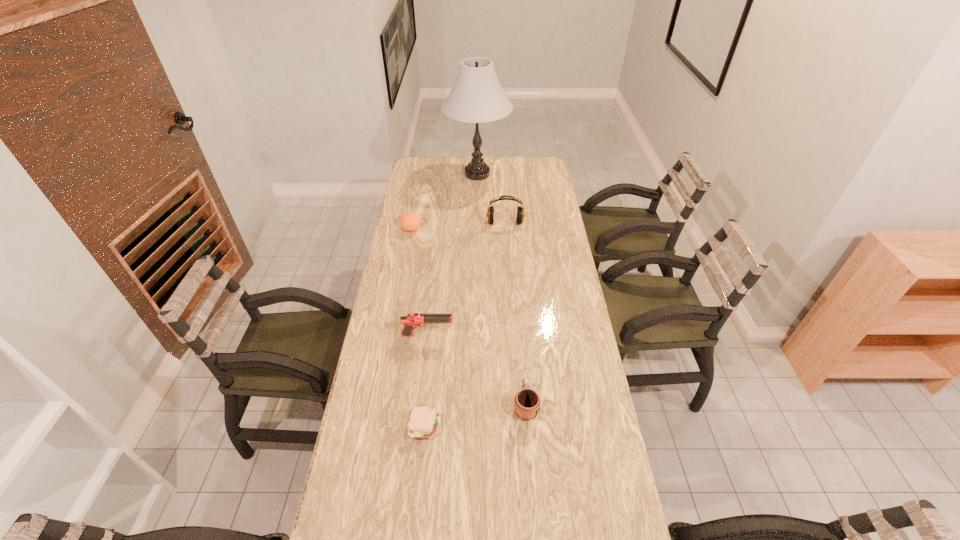
This screenshot has width=960, height=540. In the image, there is a desktop. What are the coordinates of `vacant space at the left edge` in the screenshot? It's located at (412, 180).

I want to click on vacant space at the right edge of the desktop, so click(570, 256).

The image size is (960, 540). I want to click on vacant space at the far left corner of the desktop, so click(414, 159).

This screenshot has width=960, height=540. Identify the location of free space at the far right corner. (543, 176).

You are a GUI agent. You are given a task and a screenshot of the screen. Output one action in this format:
    pyautogui.click(x=<x>, y=<y>)
    Task: Click on the vacant space that is in between the shortest object and the fifth shortest object
    This screenshot has width=960, height=540.
    Given the screenshot: What is the action you would take?
    (x=465, y=325)

This screenshot has height=540, width=960. I want to click on free space between the tallest object and the mug, so click(501, 289).

Locate an element on the screen. The height and width of the screenshot is (540, 960). vacant area that lies between the second tallest object and the fourth tallest object is located at coordinates (458, 226).

You are a GUI agent. You are given a task and a screenshot of the screen. Output one action in this format:
    pyautogui.click(x=<x>, y=<y>)
    Task: Click on the empty location between the fourth shortest object and the patty
    
    Given the screenshot: What is the action you would take?
    pyautogui.click(x=426, y=381)

The height and width of the screenshot is (540, 960). Find the location of `free spot between the shortest object and the second shortest object`. free spot between the shortest object and the second shortest object is located at coordinates (475, 415).

The width and height of the screenshot is (960, 540). Find the location of `free area in between the second tallest object and the third tallest object`. free area in between the second tallest object and the third tallest object is located at coordinates (467, 279).